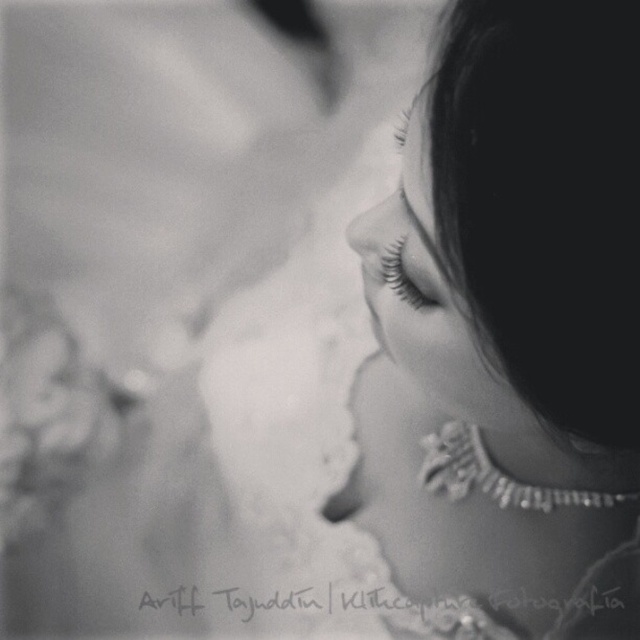
You are a photographer adjusting your camera focus. You need to ensure both the smooth skin at upper right and the black eyelashes at center are in focus. Which object should you focus on first to achieve this?

You should focus on the smooth skin at upper right first because it is closer to the viewer than the black eyelashes at center. By focusing on the closer object, the depth of field may extend to include the farther object in acceptable focus.

You are a photographer adjusting the focus on a camera. You want to ensure both the pearl necklace at upper right and the smooth skin at upper right are in sharp focus. The camera has a depth of field that can cover 2 inches. Based on the scene description, will both objects be in focus?

The pearl necklace at upper right and smooth skin at upper right are 2.12 inches apart. Since the depth of field can only cover 2 inches, the distance between them exceeds the camera setting. Therefore, both objects cannot be in focus simultaneously.

You are a photographer adjusting the focus on a camera. You want to ensure both the pearl necklace at upper right and the black eyelashes at center are in focus. Given their sizes in the image, which object should you adjust the focus towards first to capture both clearly?

The pearl necklace at upper right is much taller than the black eyelashes at center, so you should focus on the pearl necklace at upper right first since it is larger and requires more precise focus to capture its details clearly.